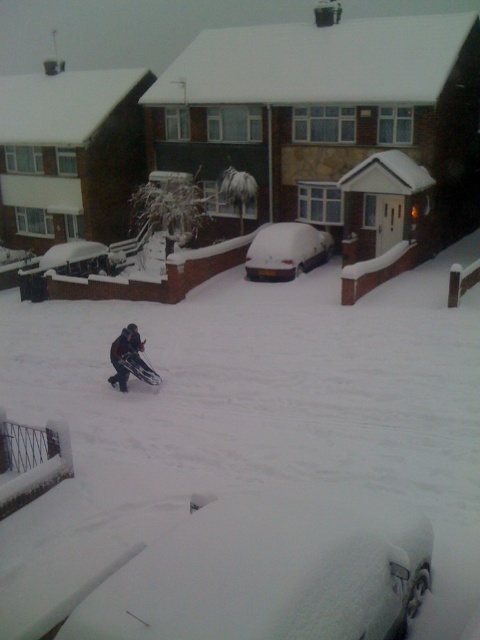
Question: Among these points, which one is nearest to the camera?

Choices:
 (A) (255, 561)
 (B) (276, 276)

Answer: (A)

Question: Can you confirm if snow-covered car at center is smaller than metallic silver snowmobile at center?

Choices:
 (A) yes
 (B) no

Answer: (B)

Question: Does snow-covered car at lower center have a larger size compared to snow-covered car at center?

Choices:
 (A) no
 (B) yes

Answer: (A)

Question: Among these points, which one is farthest from the camera?

Choices:
 (A) (133, 364)
 (B) (247, 634)

Answer: (A)

Question: Does snow-covered car at lower center appear on the left side of metallic silver snowmobile at center?

Choices:
 (A) no
 (B) yes

Answer: (A)

Question: Which is farther from the snow-covered car at lower center?

Choices:
 (A) snow-covered car at center
 (B) metallic silver snowmobile at center

Answer: (A)